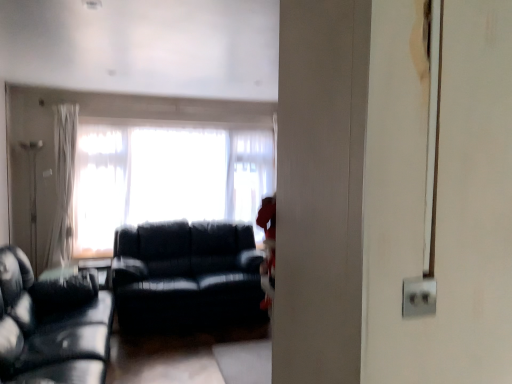
Where is `white glossy screen door at right`? white glossy screen door at right is located at coordinates (439, 195).

Describe the element at coordinates (51, 325) in the screenshot. The width and height of the screenshot is (512, 384). I see `black leather couch at left, which ranks as the first studio couch in front-to-back order` at that location.

How much space does matte black couch at center, the 2th studio couch when ordered from front to back, occupy horizontally?

It is 38.53 inches.

Identify the location of white glossy screen door at right. (439, 195).

Based on the photo, considering the positions of objects black leather couch at left, the 2th studio couch in the back-to-front sequence, and matte black couch at center, the 1th studio couch when ordered from back to front, in the image provided, who is in front, black leather couch at left, the 2th studio couch in the back-to-front sequence, or matte black couch at center, the 1th studio couch when ordered from back to front,?

black leather couch at left, the 2th studio couch in the back-to-front sequence, is closer to the camera.

In the scene shown: How many degrees apart are the facing directions of black leather couch at left, which ranks as the first studio couch in front-to-back order, and matte black couch at center, the 1th studio couch when ordered from back to front?

The facing directions of black leather couch at left, which ranks as the first studio couch in front-to-back order, and matte black couch at center, the 1th studio couch when ordered from back to front, are 89.1 degrees apart.

Consider the image. How far apart are black leather couch at left, which ranks as the first studio couch in front-to-back order, and matte black couch at center, the 2th studio couch when ordered from front to back?

black leather couch at left, which ranks as the first studio couch in front-to-back order, is 99.16 centimeters from matte black couch at center, the 2th studio couch when ordered from front to back.

Could you tell me if black leather couch at left, which ranks as the first studio couch in front-to-back order, is facing matte black couch at center, the 2th studio couch when ordered from front to back?

Answer: Yes.

Which is closer, (243, 193) or (63, 364)?

Point (243, 193).

Which is more to the right, translucent fabric window at center or black leather couch at left, the 2th studio couch in the back-to-front sequence?

translucent fabric window at center.

Image resolution: width=512 pixels, height=384 pixels. I want to click on window on the right of black leather couch at left, which ranks as the first studio couch in front-to-back order, so click(x=165, y=178).

From a real-world perspective, between translucent fabric window at center and black leather couch at left, which ranks as the first studio couch in front-to-back order, who is vertically higher?

translucent fabric window at center is physically above.

Between matte black couch at center, the 2th studio couch when ordered from front to back, and translucent fabric window at center, which one appears on the right side from the viewer's perspective?

From the viewer's perspective, matte black couch at center, the 2th studio couch when ordered from front to back, appears more on the right side.

Which is nearer, (247,224) or (135,182)?

Point (135,182)

Which of these two, matte black couch at center, the 1th studio couch when ordered from back to front, or translucent fabric window at center, is wider?

matte black couch at center, the 1th studio couch when ordered from back to front.

Consider the image. Is matte black couch at center, the 1th studio couch when ordered from back to front, inside or outside of black leather couch at left, which ranks as the first studio couch in front-to-back order?

matte black couch at center, the 1th studio couch when ordered from back to front, is outside black leather couch at left, which ranks as the first studio couch in front-to-back order.

Which of these two, matte black couch at center, the 2th studio couch when ordered from front to back, or black leather couch at left, which ranks as the first studio couch in front-to-back order, is wider?

Wider between the two is matte black couch at center, the 2th studio couch when ordered from front to back.

Relative to black leather couch at left, the 2th studio couch in the back-to-front sequence, is matte black couch at center, the 2th studio couch when ordered from front to back, in front or behind?

Visually, matte black couch at center, the 2th studio couch when ordered from front to back, is located behind black leather couch at left, the 2th studio couch in the back-to-front sequence.

From a real-world perspective, is matte black couch at center, the 1th studio couch when ordered from back to front, positioned under black leather couch at left, the 2th studio couch in the back-to-front sequence, based on gravity?

No, from a real-world perspective, matte black couch at center, the 1th studio couch when ordered from back to front, is not below black leather couch at left, the 2th studio couch in the back-to-front sequence.

Between black leather couch at left, the 2th studio couch in the back-to-front sequence, and white glossy screen door at right, which one has less height?

white glossy screen door at right is shorter.

Does point (71, 355) appear closer or farther from the camera than point (494, 347)?

Point (71, 355) is farther from the camera than point (494, 347).

From a real-world perspective, who is located lower, black leather couch at left, the 2th studio couch in the back-to-front sequence, or white glossy screen door at right?

black leather couch at left, the 2th studio couch in the back-to-front sequence, from a real-world perspective.

Does black leather couch at left, which ranks as the first studio couch in front-to-back order, have a larger size compared to white glossy screen door at right?

Correct, black leather couch at left, which ranks as the first studio couch in front-to-back order, is larger in size than white glossy screen door at right.

From the image's perspective, which is below, black leather couch at left, the 2th studio couch in the back-to-front sequence, or translucent fabric window at center?

black leather couch at left, the 2th studio couch in the back-to-front sequence, from the image's perspective.

Is black leather couch at left, the 2th studio couch in the back-to-front sequence, not inside translucent fabric window at center?

black leather couch at left, the 2th studio couch in the back-to-front sequence, is positioned outside translucent fabric window at center.

Is point (13, 275) closer or farther from the camera than point (177, 168)?

Point (13, 275) appears to be closer to the viewer than point (177, 168).

From a real-world perspective, is black leather couch at left, the 2th studio couch in the back-to-front sequence, physically located above or below translucent fabric window at center?

In terms of real-world spatial position, black leather couch at left, the 2th studio couch in the back-to-front sequence, is below translucent fabric window at center.

Considering the relative sizes of translucent fabric window at center and matte black couch at center, the 2th studio couch when ordered from front to back, in the image provided, is translucent fabric window at center wider than matte black couch at center, the 2th studio couch when ordered from front to back,?

No.

Does translucent fabric window at center turn towards matte black couch at center, the 2th studio couch when ordered from front to back?

Yes, translucent fabric window at center is turned towards matte black couch at center, the 2th studio couch when ordered from front to back.

Does translucent fabric window at center appear on the right side of matte black couch at center, the 2th studio couch when ordered from front to back?

In fact, translucent fabric window at center is to the left of matte black couch at center, the 2th studio couch when ordered from front to back.

This screenshot has width=512, height=384. In order to click on studio couch that appears on the left of matte black couch at center, the 1th studio couch when ordered from back to front in this screenshot , I will do `click(51, 325)`.

Find the location of a particular element. The image size is (512, 384). studio couch that is the 2nd one when counting downward from the translucent fabric window at center (from the image's perspective) is located at coordinates (51, 325).

Considering their positions, is white sheer curtain at left positioned closer to white glossy screen door at right than black leather couch at left, which ranks as the first studio couch in front-to-back order?

black leather couch at left, which ranks as the first studio couch in front-to-back order, is closer to white glossy screen door at right.

Looking at the image, which one is located closer to white glossy screen door at right, translucent fabric window at center or white sheer curtain at left?

white sheer curtain at left is closer to white glossy screen door at right.

Considering their positions, is white glossy screen door at right positioned closer to translucent fabric window at center than white sheer curtain at left?

The object closer to translucent fabric window at center is white sheer curtain at left.

When comparing their distances from white sheer curtain at left, does matte black couch at center, the 1th studio couch when ordered from back to front, or black leather couch at left, the 2th studio couch in the back-to-front sequence, seem closer?

Based on the image, matte black couch at center, the 1th studio couch when ordered from back to front, appears to be nearer to white sheer curtain at left.

Based on their spatial positions, is white glossy screen door at right or black leather couch at left, which ranks as the first studio couch in front-to-back order, closer to matte black couch at center, the 1th studio couch when ordered from back to front?

Based on the image, black leather couch at left, which ranks as the first studio couch in front-to-back order, appears to be nearer to matte black couch at center, the 1th studio couch when ordered from back to front.

Looking at the image, which one is located further to white glossy screen door at right, translucent fabric window at center or matte black couch at center, the 2th studio couch when ordered from front to back?

The object further to white glossy screen door at right is translucent fabric window at center.

Based on the photo, from the image, which object appears to be nearer to matte black couch at center, the 1th studio couch when ordered from back to front, white sheer curtain at left or translucent fabric window at center?

translucent fabric window at center lies closer to matte black couch at center, the 1th studio couch when ordered from back to front, than the other object.

When comparing their distances from white glossy screen door at right, does black leather couch at left, the 2th studio couch in the back-to-front sequence, or translucent fabric window at center seem closer?

Among the two, black leather couch at left, the 2th studio couch in the back-to-front sequence, is located nearer to white glossy screen door at right.

Find the location of a particular element. The width and height of the screenshot is (512, 384). studio couch positioned between black leather couch at left, the 2th studio couch in the back-to-front sequence, and translucent fabric window at center from near to far is located at coordinates (186, 275).

Image resolution: width=512 pixels, height=384 pixels. In order to click on studio couch between white glossy screen door at right and translucent fabric window at center along the z-axis in this screenshot , I will do `click(186, 275)`.

At what (x,y) coordinates should I click in order to perform the action: click on screen door between black leather couch at left, the 2th studio couch in the back-to-front sequence, and matte black couch at center, the 1th studio couch when ordered from back to front, from front to back. Please return your answer as a coordinate pair (x, y). Image resolution: width=512 pixels, height=384 pixels. Looking at the image, I should click on point(439,195).

This screenshot has height=384, width=512. In order to click on screen door positioned between black leather couch at left, the 2th studio couch in the back-to-front sequence, and white sheer curtain at left from near to far in this screenshot , I will do `click(439, 195)`.